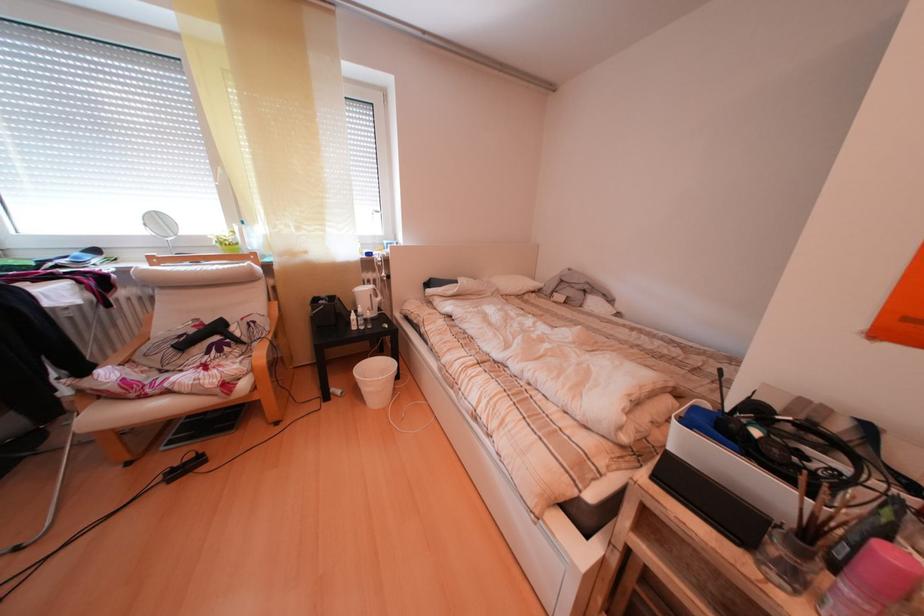
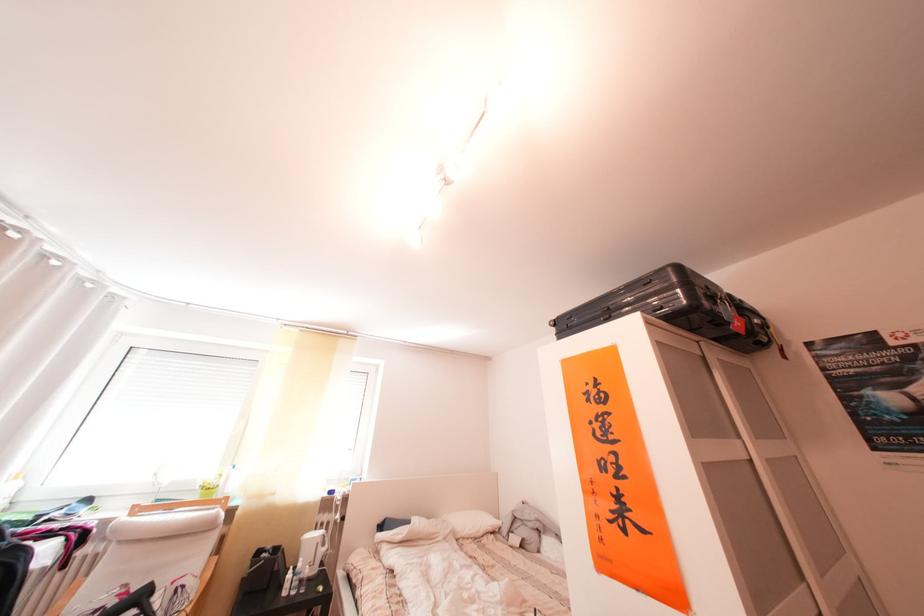
Locate, in the second image, the point that corresponds to [505,294] in the first image.

(459, 537)